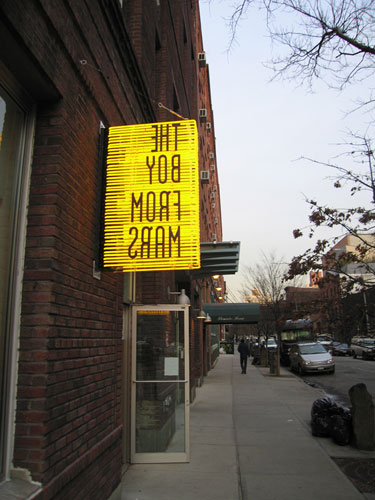
You are a GUI agent. You are given a task and a screenshot of the screen. Output one action in this format:
    pyautogui.click(x=<x>, y=<y>)
    Task: Click on the door
    
    Given the screenshot: What is the action you would take?
    pyautogui.click(x=163, y=362)